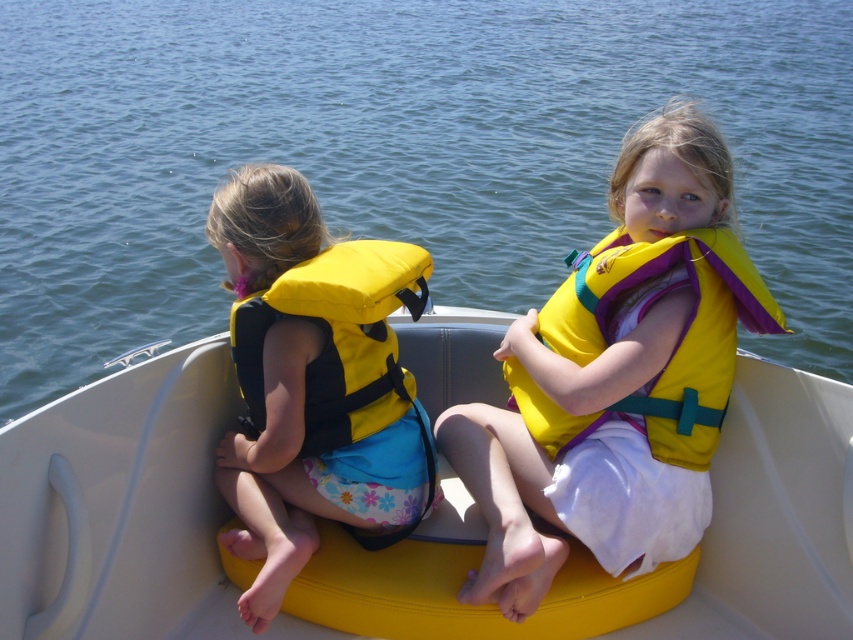
Between yellow fabric life jacket at center and yellow fabric life jacket at left, which one has less height?

Standing shorter between the two is yellow fabric life jacket at left.

Find the location of a particular element. yellow fabric life jacket at center is located at coordinates (672, 349).

This screenshot has width=853, height=640. Describe the element at coordinates (672, 349) in the screenshot. I see `yellow fabric life jacket at center` at that location.

Locate an element on the screen. The height and width of the screenshot is (640, 853). yellow fabric life jacket at center is located at coordinates 672,349.

Who is taller, blue water at center or yellow fabric life vest at left?

Standing taller between the two is blue water at center.

Is blue water at center smaller than yellow fabric life vest at left?

Actually, blue water at center might be larger than yellow fabric life vest at left.

Which is in front, point (73, 262) or point (403, 275)?

Point (403, 275) is more forward.

At what (x,y) coordinates should I click in order to perform the action: click on blue water at center. Please return your answer as a coordinate pair (x, y). The height and width of the screenshot is (640, 853). Looking at the image, I should click on (393, 152).

Is blue water at center taller than yellow fabric life vest at center?

Indeed, blue water at center has a greater height compared to yellow fabric life vest at center.

Between blue water at center and yellow fabric life vest at center, which one has more height?

blue water at center

The height and width of the screenshot is (640, 853). Identify the location of blue water at center. (393, 152).

I want to click on blue water at center, so 393,152.